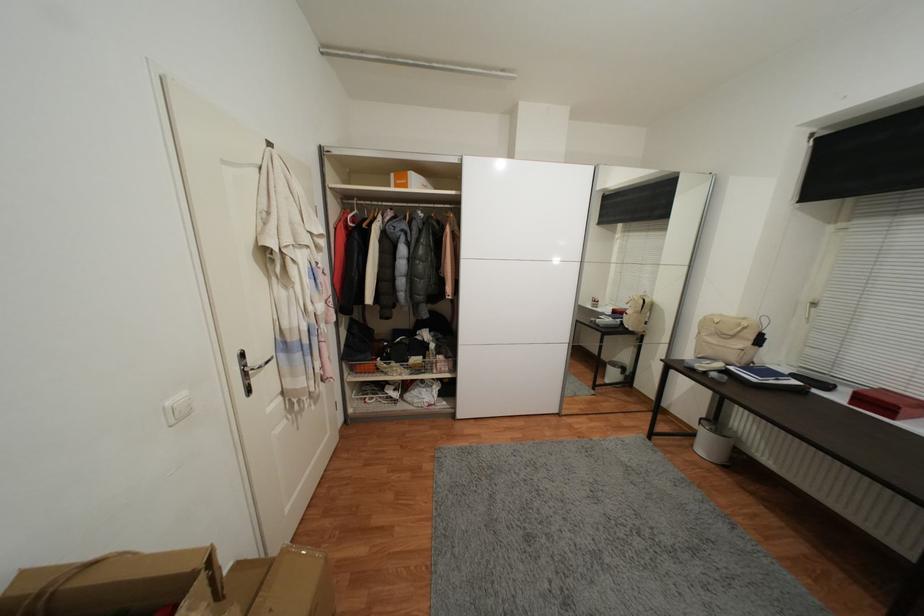
Where would you lift the orange cardboard box? Please return your answer as a coordinate pair (x, y).

(408, 180)